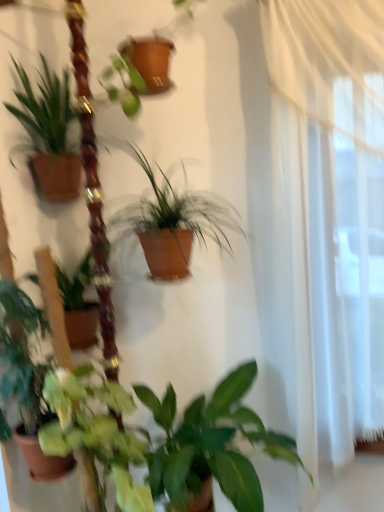
Question: Considering the relative sizes of green matte leafy plant at lower center and green matte plant at lower center, which appears as the 1th houseplant when ordered from the bottom, in the image provided, is green matte leafy plant at lower center taller than green matte plant at lower center, which appears as the 1th houseplant when ordered from the bottom,?

Choices:
 (A) yes
 (B) no

Answer: (A)

Question: Could green matte plant at lower center, placed as the fourth houseplant when sorted from top to bottom, be considered to be inside green matte leafy plant at lower center?

Choices:
 (A) no
 (B) yes

Answer: (A)

Question: Considering the relative positions of green matte leafy plant at lower center and green matte plant at lower center, placed as the fourth houseplant when sorted from top to bottom, in the image provided, is green matte leafy plant at lower center to the right of green matte plant at lower center, placed as the fourth houseplant when sorted from top to bottom, from the viewer's perspective?

Choices:
 (A) no
 (B) yes

Answer: (A)

Question: Considering the relative sizes of green matte leafy plant at lower center and green matte plant at lower center, placed as the fourth houseplant when sorted from top to bottom, in the image provided, is green matte leafy plant at lower center smaller than green matte plant at lower center, placed as the fourth houseplant when sorted from top to bottom,?

Choices:
 (A) no
 (B) yes

Answer: (B)

Question: Is green matte leafy plant at lower center closer to camera compared to green matte plant at lower center, placed as the fourth houseplant when sorted from top to bottom?

Choices:
 (A) no
 (B) yes

Answer: (B)

Question: Is green matte plant at left, the third houseplant from the top, taller or shorter than green matte plant at lower center, which appears as the 1th houseplant when ordered from the bottom?

Choices:
 (A) short
 (B) tall

Answer: (B)

Question: Does point (11, 287) appear closer or farther from the camera than point (182, 467)?

Choices:
 (A) farther
 (B) closer

Answer: (B)

Question: From the image's perspective, is green matte plant at left, which is the second houseplant in bottom-to-top order, above or below green matte plant at lower center, which appears as the 1th houseplant when ordered from the bottom?

Choices:
 (A) above
 (B) below

Answer: (A)

Question: From a real-world perspective, is green matte plant at left, the third houseplant from the top, physically located above or below green matte plant at lower center, which appears as the 1th houseplant when ordered from the bottom?

Choices:
 (A) below
 (B) above

Answer: (B)

Question: Looking at the image, does brown matte pot at center, the 2th houseplant positioned from the top, seem bigger or smaller compared to green matte plant at lower center, which appears as the 1th houseplant when ordered from the bottom?

Choices:
 (A) small
 (B) big

Answer: (A)

Question: Is brown matte pot at center, the 2th houseplant positioned from the top, spatially inside green matte plant at lower center, placed as the fourth houseplant when sorted from top to bottom, or outside of it?

Choices:
 (A) inside
 (B) outside

Answer: (B)

Question: Relative to green matte plant at lower center, which appears as the 1th houseplant when ordered from the bottom, is brown matte pot at center, the 2th houseplant positioned from the top, in front or behind?

Choices:
 (A) front
 (B) behind

Answer: (A)

Question: From the image's perspective, is brown matte pot at center, the 3th houseplant when ordered from bottom to top, above or below green matte plant at lower center, placed as the fourth houseplant when sorted from top to bottom?

Choices:
 (A) above
 (B) below

Answer: (A)

Question: Is green matte leafy plant at lower center in front of or behind green matte plant at lower center, placed as the fourth houseplant when sorted from top to bottom, in the image?

Choices:
 (A) front
 (B) behind

Answer: (A)

Question: From the image's perspective, is green matte leafy plant at lower center above or below green matte plant at lower center, which appears as the 1th houseplant when ordered from the bottom?

Choices:
 (A) below
 (B) above

Answer: (B)